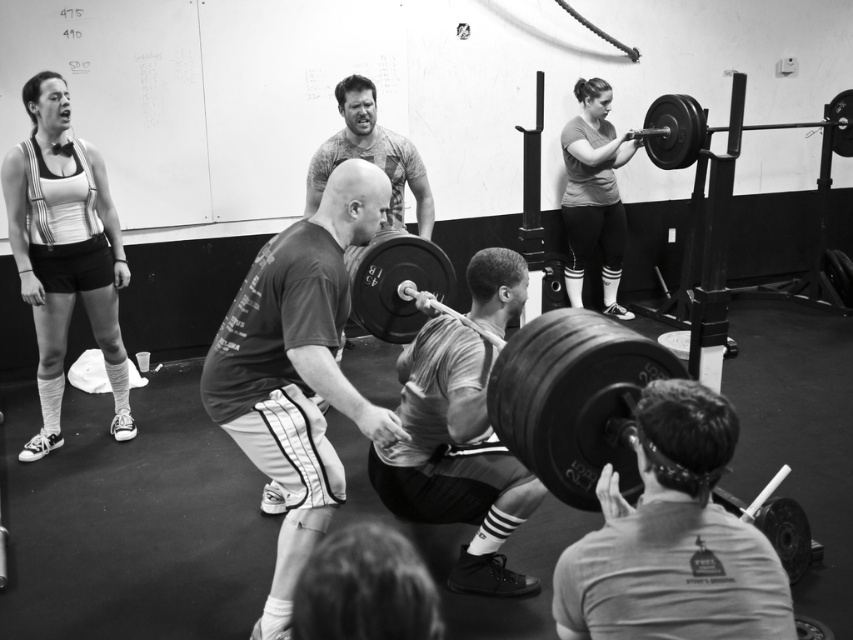
Who is more distant from viewer, [566,243] or [405,237]?

The point [566,243] is more distant.

Is matte gray shirt at center positioned behind black rubber barbell at center?

Yes, it is behind black rubber barbell at center.

Is point (599, 216) positioned before point (451, 282)?

No, (599, 216) is behind (451, 282).

Find the location of a particular element. This screenshot has width=853, height=640. matte gray shirt at center is located at coordinates (593, 195).

Does black rubber barbell at center appear on the left side of printed fabric shirt at center?

No, black rubber barbell at center is not to the left of printed fabric shirt at center.

Who is higher up, black rubber barbell at center or printed fabric shirt at center?

Positioned higher is printed fabric shirt at center.

Which is behind, point (439, 268) or point (425, 186)?

The point (425, 186) is more distant.

This screenshot has height=640, width=853. Identify the location of black rubber barbell at center. (395, 282).

Who is more distant from viewer, [372,100] or [698,112]?

Positioned behind is point [698,112].

Which of these two, printed fabric shirt at center or black rubber barbell at upper right, stands taller?

printed fabric shirt at center

This screenshot has height=640, width=853. What are the coordinates of `printed fabric shirt at center` in the screenshot? It's located at (370, 154).